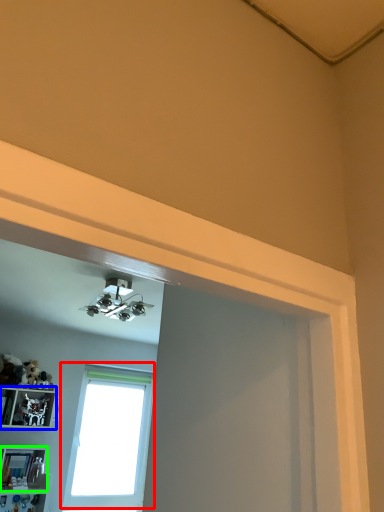
Question: Considering the real-world distances, which object is farthest from window (highlighted by a red box)? shelf (highlighted by a blue box) or shelf (highlighted by a green box)?

Choices:
 (A) shelf
 (B) shelf

Answer: (B)